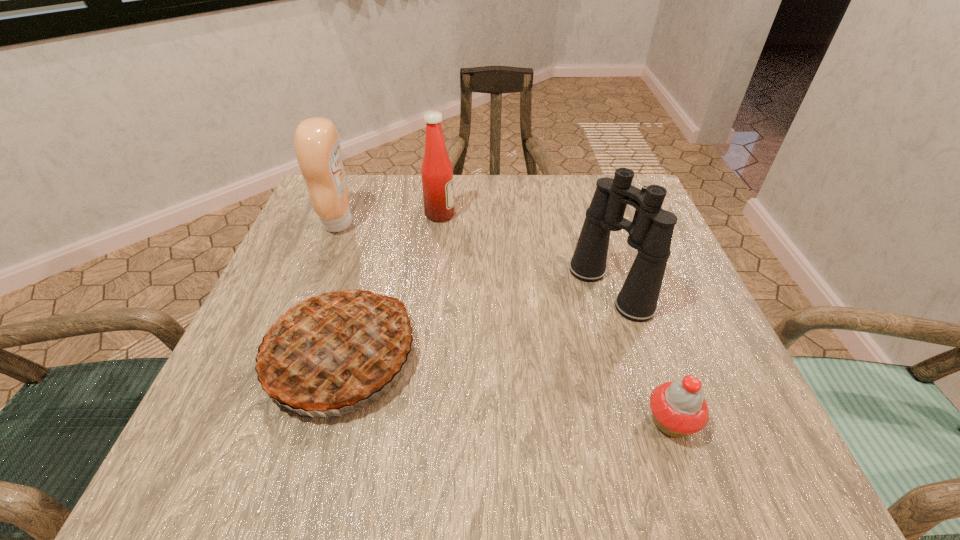
Find the location of `vacant point located between the second shortest object and the binoculars`. vacant point located between the second shortest object and the binoculars is located at coordinates (475, 322).

Locate an element on the screen. The height and width of the screenshot is (540, 960). empty space between the shortest object and the binoculars is located at coordinates (640, 355).

You are a GUI agent. You are given a task and a screenshot of the screen. Output one action in this format:
    pyautogui.click(x=<x>, y=<y>)
    Task: Click on the free space between the left condiment and the shortest object
    This screenshot has width=960, height=540.
    Given the screenshot: What is the action you would take?
    (x=505, y=322)

Find the location of a particular element. This screenshot has height=540, width=960. empty space that is in between the left condiment and the cupcake is located at coordinates (505, 322).

Identify which object is located as the third nearest to the binoculars. Please provide its 2D coordinates. Your answer should be formatted as a tuple, i.e. [(x, y)], where the tuple contains the x and y coordinates of a point satisfying the conditions above.

[(333, 349)]

Identify which object is the fourth closest to the left condiment. Please provide its 2D coordinates. Your answer should be formatted as a tuple, i.e. [(x, y)], where the tuple contains the x and y coordinates of a point satisfying the conditions above.

[(678, 407)]

I want to click on vacant region that satisfies the following two spatial constraints: 1. on the label of the left condiment; 2. on the left side of the pie, so click(285, 357).

I want to click on free spot that satisfies the following two spatial constraints: 1. on the front-facing side of the right condiment; 2. on the left side of the binoculars, so click(432, 288).

Find the location of a particular element. The image size is (960, 540). vacant area in the image that satisfies the following two spatial constraints: 1. on the front-facing side of the right condiment; 2. on the front side of the fourth tallest object is located at coordinates (424, 357).

You are a GUI agent. You are given a task and a screenshot of the screen. Output one action in this format:
    pyautogui.click(x=<x>, y=<y>)
    Task: Click on the vacant space that satisfies the following two spatial constraints: 1. on the front side of the shortest object; 2. on the right side of the pie
    This screenshot has width=960, height=540.
    Given the screenshot: What is the action you would take?
    pyautogui.click(x=323, y=422)